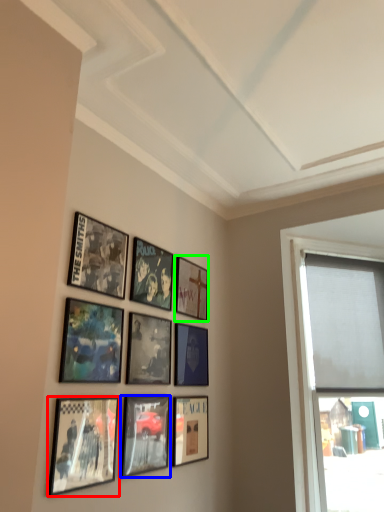
Question: Estimate the real-world distances between objects in this image. Which object is closer to picture frame (highlighted by a red box), picture frame (highlighted by a blue box) or picture frame (highlighted by a green box)?

Choices:
 (A) picture frame
 (B) picture frame

Answer: (A)